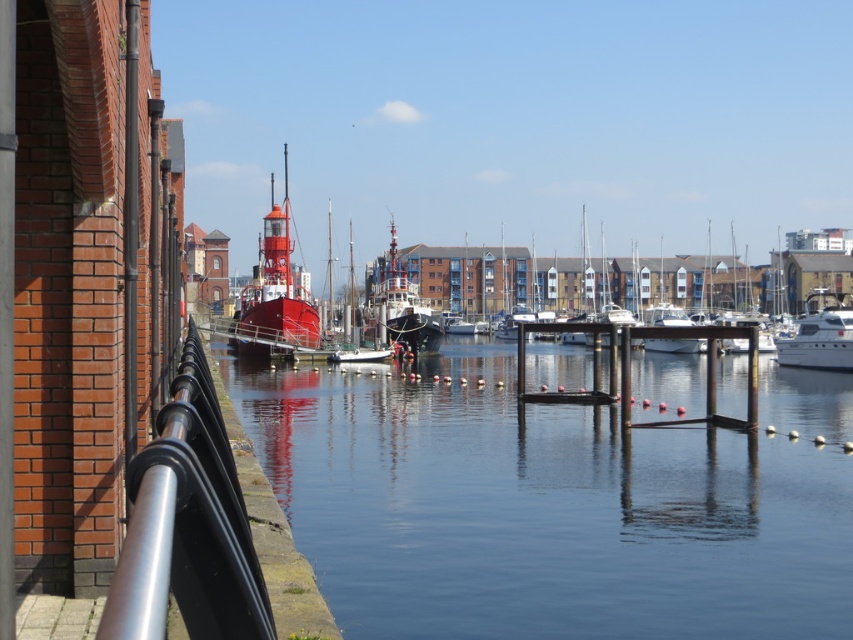
You are a photographer planning to take a photo of the shiny red boat at center and the white glossy boat at right from the metal railing. Considering their heights, which boat should you focus on first to ensure both are in frame without adjusting your camera angle?

The shiny red boat at center is much taller than the white glossy boat at right, so you should focus on the shiny red boat at center first to ensure both are in frame without adjusting your camera angle.

Consider the image. You are a photographer trying to capture the white glossy boat at right through the silver metallic railing at lower left. Since the railing is thinner, will it block less of the boat in your photo?

The silver metallic railing at lower left is thinner than the white glossy boat at right, so it will block less of the boat in your photo.

You are standing at the center of the metal railing near the waterline. You want to find the shiny red boat at center. According to the coordinates, where should you look relative to your position?

The shiny red boat at center is located at coordinates 0.458 on the x axis and 0.322 on the y axis, so you should look slightly to the right and forward from your position at the center of the metal railing.